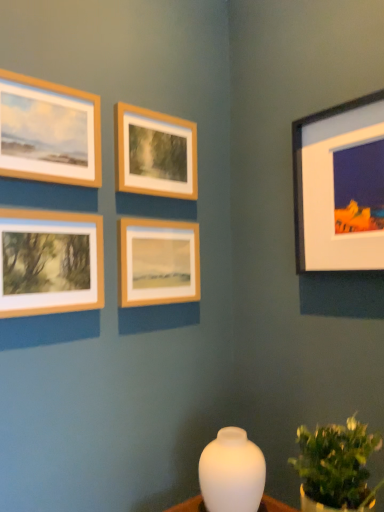
Question: In terms of size, does wooden frame at upper left, the 1th picture frame positioned from the left, appear bigger or smaller than green leafy plant at lower right?

Choices:
 (A) big
 (B) small

Answer: (B)

Question: Visually, is wooden frame at upper left, the 1th picture frame positioned from the left, positioned to the left or to the right of green leafy plant at lower right?

Choices:
 (A) left
 (B) right

Answer: (A)

Question: Which is nearer to the wooden frame at center, which ranks as the second picture frame in right-to-left order?

Choices:
 (A) matte wooden frame at lower left, acting as the 2th picture frame starting from the left
 (B) white glossy vase at center
 (C) wooden frame at upper left, the 1th picture frame positioned from the left
 (D) green leafy plant at lower right
 (E) black matte frame at upper right, the first picture frame positioned from the right

Answer: (A)

Question: Which is farther from the black matte frame at upper right, the first picture frame positioned from the right?

Choices:
 (A) wooden frame at center, the fourth picture frame viewed from the left
 (B) green leafy plant at lower right
 (C) wooden frame at upper left, the 1th picture frame positioned from the left
 (D) wooden frame at upper center, which is counted as the 3th picture frame, starting from the right
 (E) matte wooden frame at lower left, the 4th picture frame in the right-to-left sequence

Answer: (E)